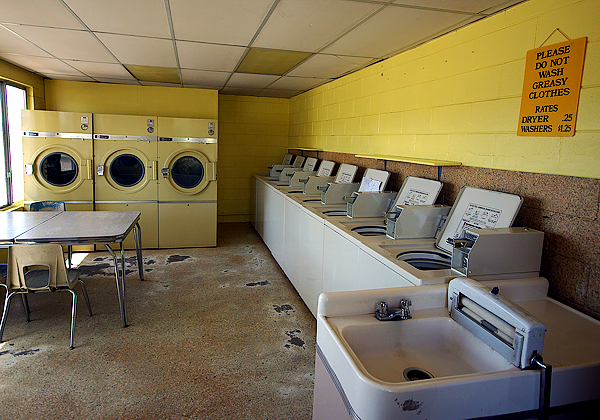
I want to click on chair, so click(44, 253).